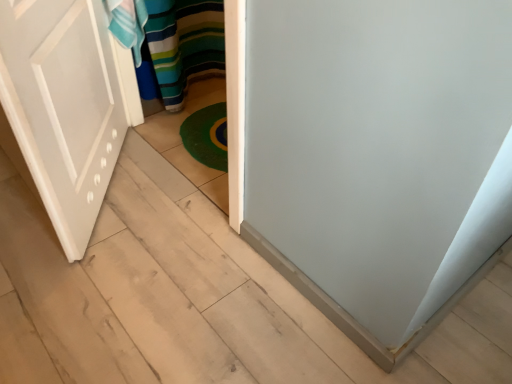
What are the coordinates of `vacant area that lies to the right of white matte door at left` in the screenshot? It's located at (180, 200).